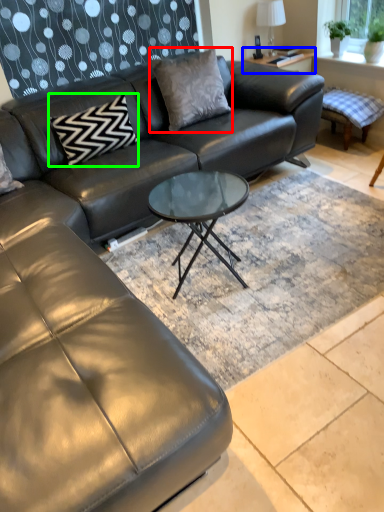
Question: Which object is positioned closest to pillow (highlighted by a red box)? Select from side table (highlighted by a blue box) and pillow (highlighted by a green box).

Choices:
 (A) side table
 (B) pillow

Answer: (B)